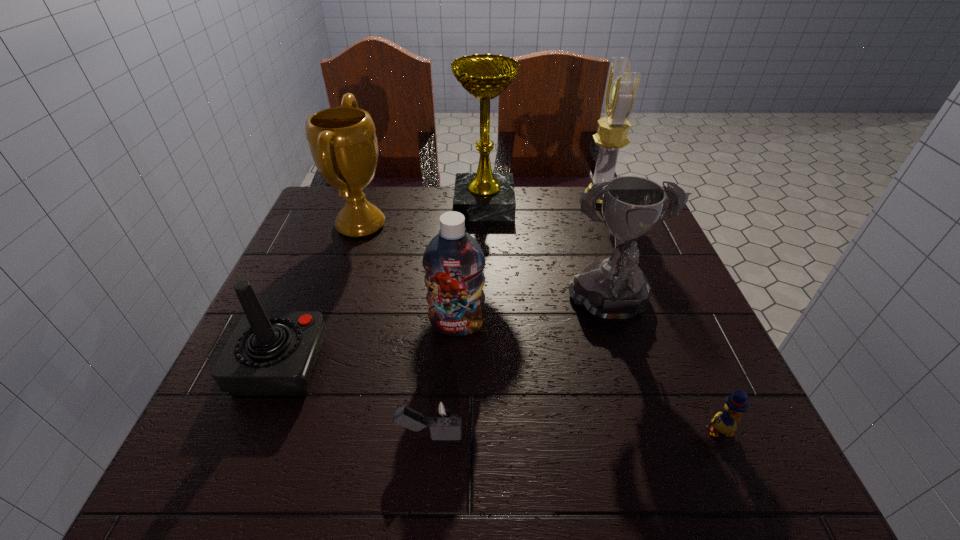
You are a GUI agent. You are given a task and a screenshot of the screen. Output one action in this format:
    pyautogui.click(x=<x>, y=<y>)
    Task: Click on the vacant space located 0.210m on the front of the leftmost award with the decoration
    This screenshot has width=960, height=540.
    Given the screenshot: What is the action you would take?
    pyautogui.click(x=470, y=225)

At what (x,y) coordinates should I click in order to perform the action: click on vacant region located on the side with emblem of the nearest award. Please return your answer as a coordinate pair (x, y). The height and width of the screenshot is (540, 960). Looking at the image, I should click on (646, 428).

Find the location of a particular element. The width and height of the screenshot is (960, 540). vacant region located 0.250m on the front label of the shampoo is located at coordinates (450, 461).

Identify the location of free space located 0.350m on the front-facing side of the sixth tallest object. (510, 364).

Locate an element on the screen. vacant space located 0.050m on the back of the igniter is located at coordinates (434, 394).

The width and height of the screenshot is (960, 540). Find the location of `igniter located at the near edge`. igniter located at the near edge is located at coordinates (443, 417).

I want to click on duckling situated at the near edge, so click(x=725, y=423).

Identify the location of award present at the left edge. (342, 140).

Locate an element on the screen. joystick present at the left edge is located at coordinates (270, 353).

Where is `duckling that is at the right edge`? Image resolution: width=960 pixels, height=540 pixels. duckling that is at the right edge is located at coordinates (725, 423).